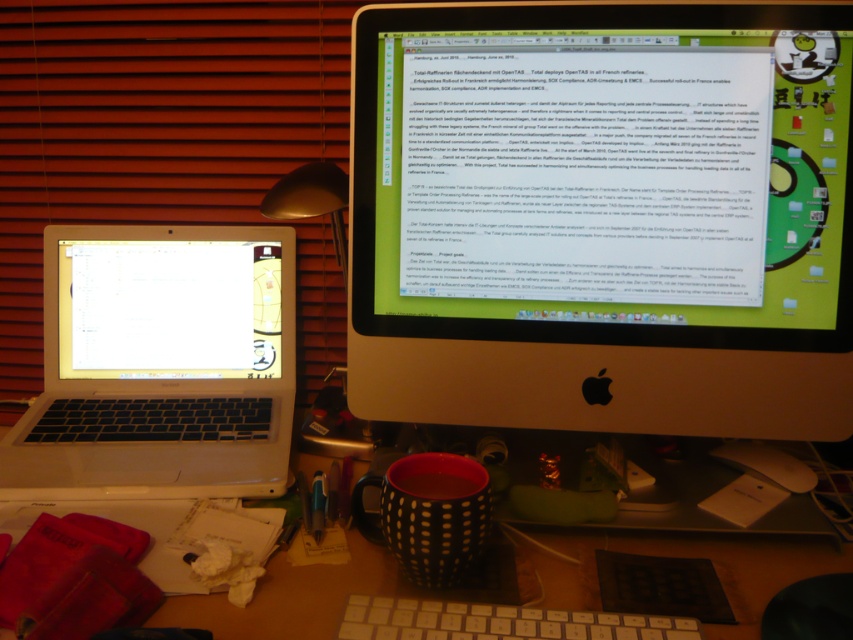
You are organizing the desk and want to place a new mouse between the matte black monitor at center and the white plastic keyboard at center. Based on their positions, where should the mouse be placed relative to the keyboard?

The matte black monitor at center is positioned on the right side of the white plastic keyboard at center, so the mouse should be placed to the right of the white plastic keyboard at center, between it and the matte black monitor at center.

You are organizing your desk and need to place two items at specific coordinates. The first item must be placed at point (x=846, y=388) and the second at point (x=560, y=620). Which point is closer to the edge of the desk?

Point (x=560, y=620) is closer to the edge of the desk because it is positioned further to the right compared to point (x=846, y=388), which is behind it.

You are organizing your desk and want to place a new wireless mouse between the white glossy laptop at left and the white plastic keyboard at center. Based on their positions, where should you place the mouse to ensure it is between them?

The white glossy laptop at left is to the left of the white plastic keyboard at center, so you should place the mouse to the right of the white glossy laptop at left but to the left of the white plastic keyboard at center.